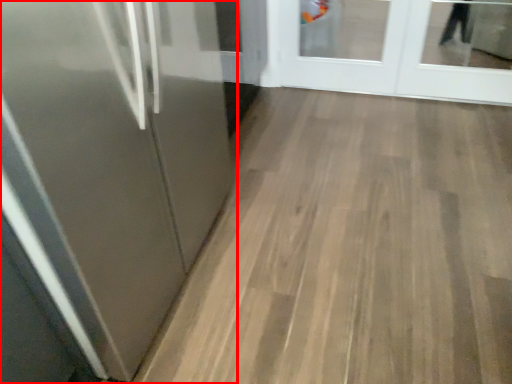
Question: From the image's perspective, where is door (annotated by the red box) located in relation to door in the image?

Choices:
 (A) below
 (B) above

Answer: (A)